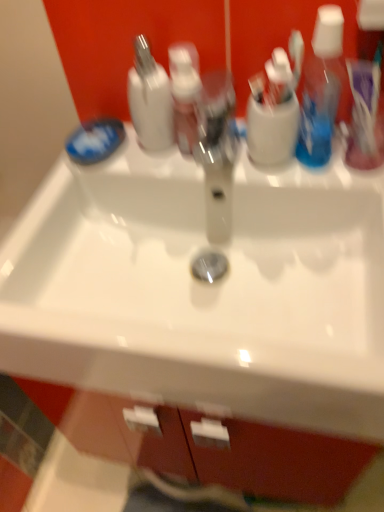
Question: From a real-world perspective, is translucent plastic toothbrush at upper right positioned above or below white glossy sink at center?

Choices:
 (A) above
 (B) below

Answer: (A)

Question: From the image's perspective, is translucent plastic toothbrush at upper right above or below white glossy sink at center?

Choices:
 (A) below
 (B) above

Answer: (B)

Question: Which is farther from the white glossy sink at center?

Choices:
 (A) blue matte soap at left
 (B) translucent plastic toothbrush at upper right
 (C) white glossy bottle at upper center
 (D) translucent pink pump bottle at center

Answer: (B)

Question: Based on their relative distances, which object is farther from the translucent pink pump bottle at center?

Choices:
 (A) blue matte soap at left
 (B) white glossy bottle at upper center
 (C) translucent plastic toothbrush at upper right
 (D) white glossy sink at center

Answer: (D)